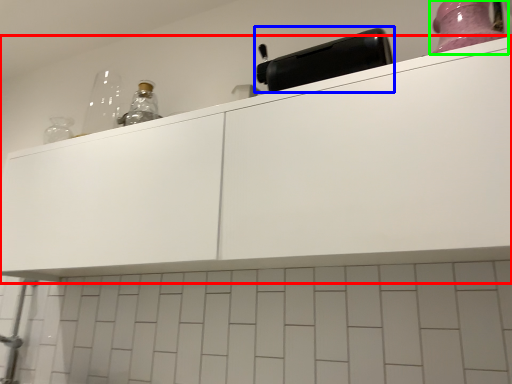
Question: Based on their relative distances, which object is nearer to cabinetry (highlighted by a red box)? Choose from appliance (highlighted by a blue box) and bottle (highlighted by a green box).

Choices:
 (A) appliance
 (B) bottle

Answer: (A)